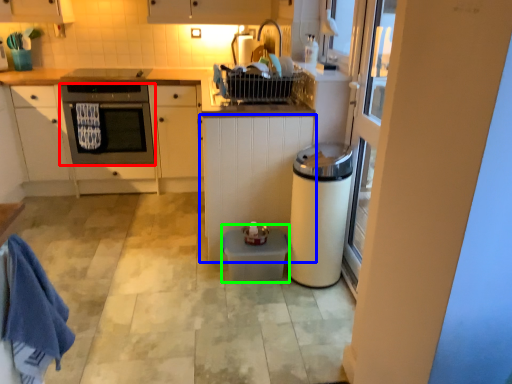
Question: Estimate the real-world distances between objects in this image. Which object is farther from home appliance (highlighted by a red box), cabinetry (highlighted by a blue box) or water heater (highlighted by a green box)?

Choices:
 (A) cabinetry
 (B) water heater

Answer: (B)